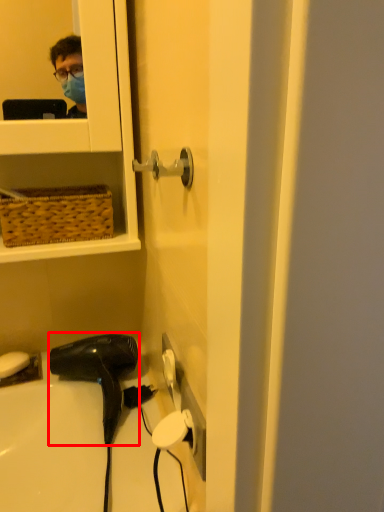
Question: From the image's perspective, where is hair drier (annotated by the red box) located in relation to soap in the image?

Choices:
 (A) above
 (B) below

Answer: (B)